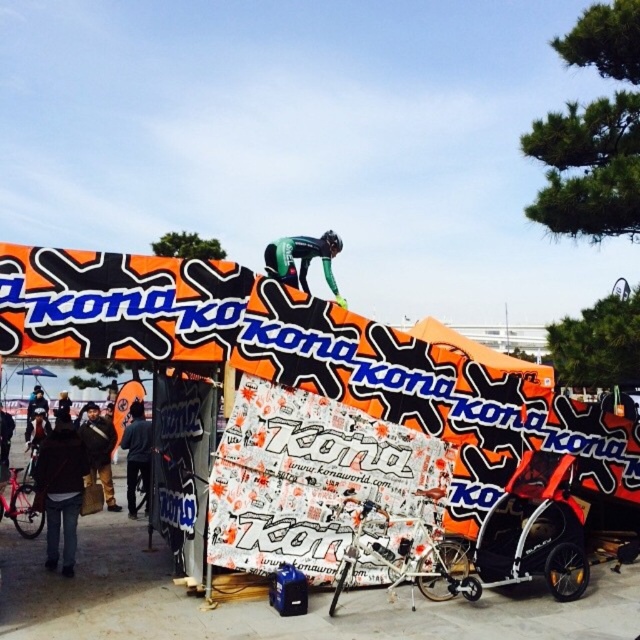
Question: Is brown leather jacket at center to the right of dark gray jacket at center from the viewer's perspective?

Choices:
 (A) no
 (B) yes

Answer: (A)

Question: Is dark brown leather jacket at lower left positioned behind brown leather jacket at center?

Choices:
 (A) no
 (B) yes

Answer: (A)

Question: Where is dark brown leather jacket at lower left located in relation to brown leather jacket at center in the image?

Choices:
 (A) below
 (B) above

Answer: (B)

Question: Which of these objects is positioned closest to the dark brown leather jacket at lower left?

Choices:
 (A) matte black bicycle at left
 (B) brown leather jacket at center
 (C) green fabric suit at center
 (D) dark gray jacket at center

Answer: (D)

Question: Which of these objects is positioned closest to the brown leather jacket at center?

Choices:
 (A) dark gray jacket at center
 (B) green fabric suit at center
 (C) matte black bicycle at left

Answer: (A)

Question: Estimate the real-world distances between objects in this image. Which object is farther from the brown leather jacket at center?

Choices:
 (A) dark gray jacket at center
 (B) green fabric suit at center

Answer: (B)